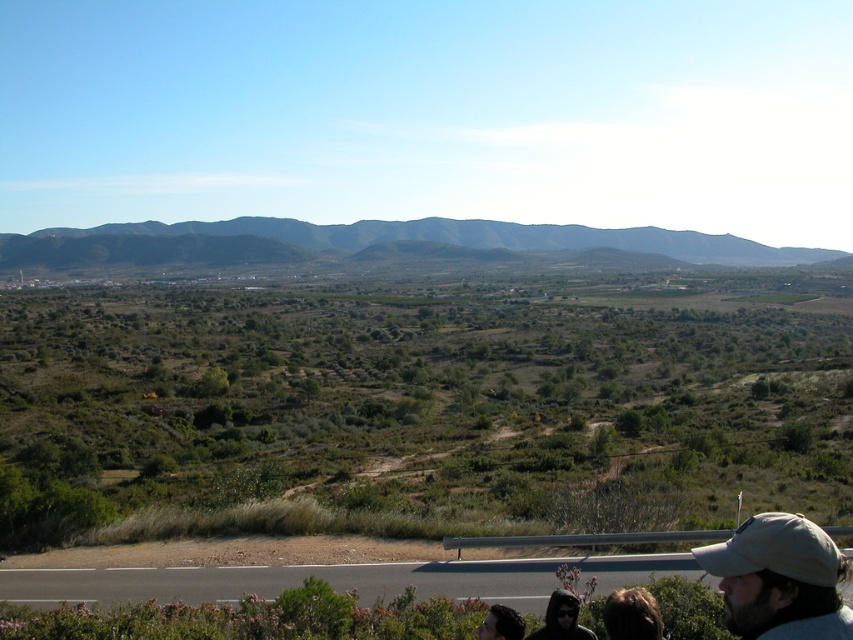
Which is more to the left, asphalt road at lower center or beige fabric cap at lower right?

Positioned to the left is asphalt road at lower center.

Find the location of a particular element. The image size is (853, 640). asphalt road at lower center is located at coordinates (334, 579).

Can you confirm if dark green textured mountains at upper center is positioned to the left of beige fabric cap at lower right?

Correct, you'll find dark green textured mountains at upper center to the left of beige fabric cap at lower right.

Does dark green textured mountains at upper center have a smaller size compared to beige fabric cap at lower right?

Incorrect, dark green textured mountains at upper center is not smaller in size than beige fabric cap at lower right.

Locate an element on the screen. dark green textured mountains at upper center is located at coordinates (479, 237).

Locate an element on the screen. This screenshot has height=640, width=853. dark green textured mountains at upper center is located at coordinates (479, 237).

Between green shrubbery at center and dark green textured mountains at upper center, which one appears on the right side from the viewer's perspective?

From the viewer's perspective, dark green textured mountains at upper center appears more on the right side.

Measure the distance between point [584,404] and camera.

They are 400.08 feet apart.

Who is more forward, (722, 465) or (329, 234)?

Point (722, 465) is more forward.

Where is `green shrubbery at center`? The width and height of the screenshot is (853, 640). green shrubbery at center is located at coordinates (416, 410).